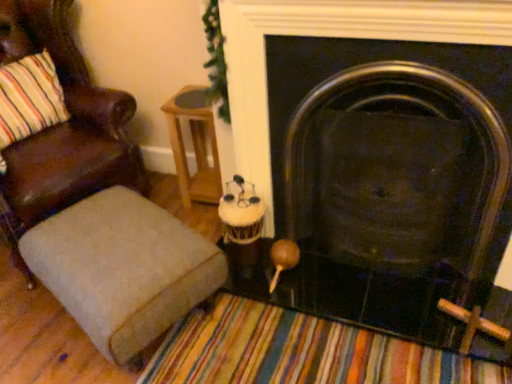
Question: From the image's perspective, is brown leather chair at left above or below black metal fireplace at center?

Choices:
 (A) below
 (B) above

Answer: (B)

Question: Is brown leather chair at left bigger or smaller than black metal fireplace at center?

Choices:
 (A) big
 (B) small

Answer: (A)

Question: Considering the real-world distances, which object is farthest from the woodenside table at center?

Choices:
 (A) brown leather chair at left
 (B) textured beige ottoman at lower left
 (C) black metal fireplace at center

Answer: (B)

Question: Estimate the real-world distances between objects in this image. Which object is farther from the black metal fireplace at center?

Choices:
 (A) woodenside table at center
 (B) textured beige ottoman at lower left
 (C) brown leather chair at left

Answer: (C)